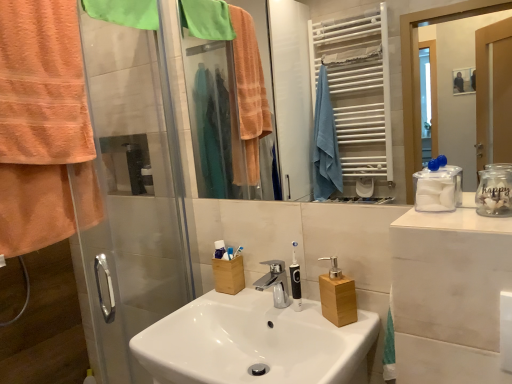
Question: Is orange terry cloth towel at left, the 1th towel/napkin when ordered from bottom to top, not inside white plastic toothbrush at center, the 1th toothbrush from the right?

Choices:
 (A) yes
 (B) no

Answer: (A)

Question: Can you confirm if orange terry cloth towel at left, the second towel/napkin viewed from the top, is bigger than white plastic toothbrush at center, the 1th toothbrush from the right?

Choices:
 (A) yes
 (B) no

Answer: (A)

Question: Is orange terry cloth towel at left, the second towel/napkin viewed from the top, thinner than white plastic toothbrush at center, the 1th toothbrush from the right?

Choices:
 (A) yes
 (B) no

Answer: (B)

Question: Can you confirm if orange terry cloth towel at left, the second towel/napkin viewed from the top, is positioned to the left of white plastic toothbrush at center, which is counted as the second toothbrush, starting from the left?

Choices:
 (A) no
 (B) yes

Answer: (B)

Question: Does orange terry cloth towel at left, the second towel/napkin viewed from the top, lie behind white plastic toothbrush at center, which is counted as the second toothbrush, starting from the left?

Choices:
 (A) yes
 (B) no

Answer: (B)

Question: From a real-world perspective, is matte plastic toothbrushes at center positioned above or below white plastic toothbrush at center, which is counted as the second toothbrush, starting from the left?

Choices:
 (A) below
 (B) above

Answer: (B)

Question: In terms of width, does matte plastic toothbrushes at center look wider or thinner when compared to white plastic toothbrush at center, the 1th toothbrush from the right?

Choices:
 (A) wide
 (B) thin

Answer: (A)

Question: Visually, is matte plastic toothbrushes at center positioned to the left or to the right of white plastic toothbrush at center, the 1th toothbrush from the right?

Choices:
 (A) right
 (B) left

Answer: (B)

Question: Is matte plastic toothbrushes at center taller or shorter than white plastic toothbrush at center, which is counted as the second toothbrush, starting from the left?

Choices:
 (A) short
 (B) tall

Answer: (B)

Question: Is wooden soap dispenser at center, the 1th bottle positioned from the back, inside or outside of green fabric towel at upper left, the 2th towel/napkin ordered from the bottom?

Choices:
 (A) inside
 (B) outside

Answer: (B)

Question: From the image's perspective, is wooden soap dispenser at center, the second bottle in the top-to-bottom sequence, above or below green fabric towel at upper left, placed as the first towel/napkin when sorted from top to bottom?

Choices:
 (A) above
 (B) below

Answer: (B)

Question: Based on their sizes in the image, would you say wooden soap dispenser at center, which is counted as the 2th bottle, starting from the right, is bigger or smaller than green fabric towel at upper left, placed as the first towel/napkin when sorted from top to bottom?

Choices:
 (A) big
 (B) small

Answer: (B)

Question: Is wooden soap dispenser at center, which ranks as the first bottle in bottom-to-top order, wider or thinner than green fabric towel at upper left, the 2th towel/napkin ordered from the bottom?

Choices:
 (A) wide
 (B) thin

Answer: (A)

Question: In terms of width, does white glossy mirror at upper center look wider or thinner when compared to white plastic toothbrush at center, the 1th toothbrush from the right?

Choices:
 (A) wide
 (B) thin

Answer: (B)

Question: In terms of size, does white glossy mirror at upper center appear bigger or smaller than white plastic toothbrush at center, which is counted as the second toothbrush, starting from the left?

Choices:
 (A) small
 (B) big

Answer: (B)